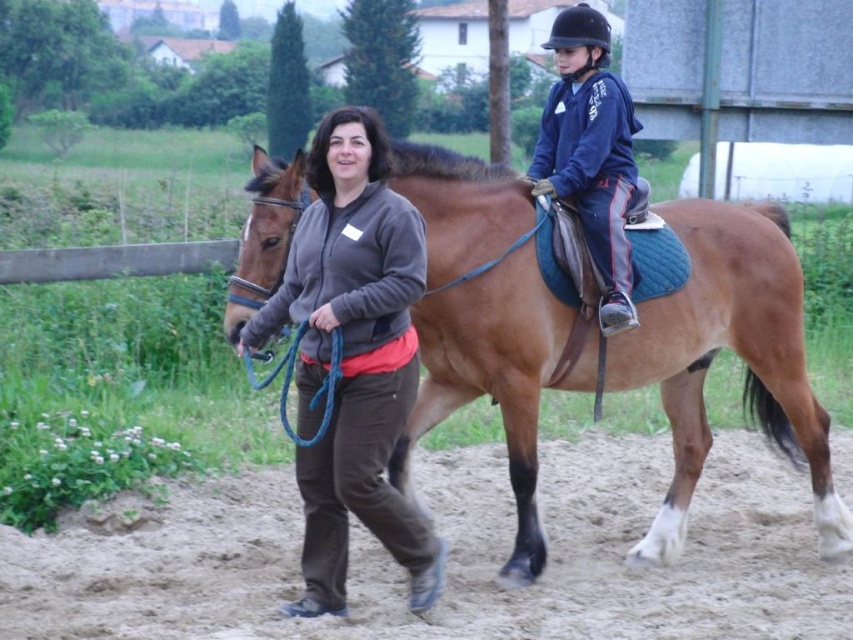
Looking at this image, you are standing in the outdoor scene and want to move from point A to point B. Point A is at coordinates point [801,508] and point B is at coordinates point [616,252]. Which point is closer to you?

Point A at coordinates point [801,508] is closer to you because it is further to the viewer than point B at coordinates point [616,252].

You are a hiker who has just arrived at the scene and want to find the path to continue your journey. You see the brown sandy dirt track at lower center and the dark gray fleece jacket at center. Which object is positioned lower in the image?

The brown sandy dirt track at lower center is located below the dark gray fleece jacket at center, so the brown sandy dirt track at lower center is positioned lower in the image.

You are a photographer standing at the edge of the scene. You need to capture a photo where both the brown sandy dirt track at lower center and the dark gray fleece jacket at center are visible. Based on their positions, which object should you adjust your camera angle to focus on first to ensure both are in frame?

The brown sandy dirt track at lower center is to the right of dark gray fleece jacket at center. To capture both in the frame, you should first focus on the dark gray fleece jacket at center since it is positioned to the left, allowing the track to naturally fall into the right side of the frame.